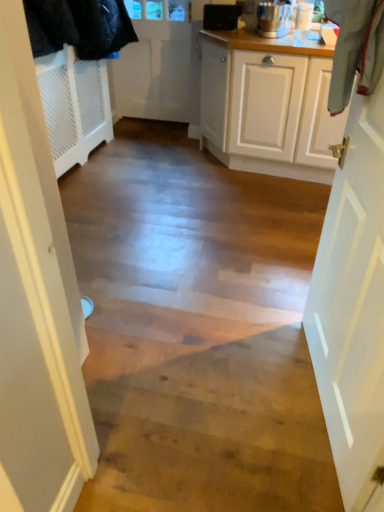
How much space does white matte door at upper center, acting as the 2th door starting from the bottom, occupy vertically?

white matte door at upper center, acting as the 2th door starting from the bottom, is 3.56 feet tall.

What do you see at coordinates (155, 63) in the screenshot?
I see `white matte door at upper center, which ranks as the first door in back-to-front order` at bounding box center [155, 63].

Locate an element on the screen. The height and width of the screenshot is (512, 384). black plastic speaker at upper center is located at coordinates (221, 17).

Considering the positions of objects white matte door at right, acting as the 2th door starting from the top, and black plastic speaker at upper center in the image provided, who is in front, white matte door at right, acting as the 2th door starting from the top, or black plastic speaker at upper center?

white matte door at right, acting as the 2th door starting from the top, is closer to the camera.

Identify the location of appliance above the white matte door at right, which is the second door from left to right (from the image's perspective). The width and height of the screenshot is (384, 512). (221, 17).

Considering the sizes of objects white matte door at right, acting as the 2th door starting from the top, and black plastic speaker at upper center in the image provided, who is bigger, white matte door at right, acting as the 2th door starting from the top, or black plastic speaker at upper center?

Bigger between the two is white matte door at right, acting as the 2th door starting from the top.

From a real-world perspective, which is physically above, white matte door at right, acting as the 2th door starting from the top, or polished stainless steel blender at upper right?

polished stainless steel blender at upper right is physically above.

Considering the points (381, 455) and (282, 15), which point is in front, point (381, 455) or point (282, 15)?

Point (381, 455)

Is white matte door at right, the first door positioned from the bottom, closer to camera compared to polished stainless steel blender at upper right?

Yes, white matte door at right, the first door positioned from the bottom, is in front of polished stainless steel blender at upper right.

Is white matte door at right, the second door in the back-to-front sequence, placed right next to polished stainless steel blender at upper right?

white matte door at right, the second door in the back-to-front sequence, is not next to polished stainless steel blender at upper right, and they're not touching.

Considering the sizes of objects black plastic speaker at upper center and polished stainless steel blender at upper right in the image provided, who is bigger, black plastic speaker at upper center or polished stainless steel blender at upper right?

polished stainless steel blender at upper right.

Is black plastic speaker at upper center inside or outside of polished stainless steel blender at upper right?

black plastic speaker at upper center exists outside the volume of polished stainless steel blender at upper right.

Which object is positioned more to the right, black plastic speaker at upper center or polished stainless steel blender at upper right?

polished stainless steel blender at upper right is more to the right.

Does black plastic speaker at upper center have a lesser width compared to polished stainless steel blender at upper right?

Correct, the width of black plastic speaker at upper center is less than that of polished stainless steel blender at upper right.

Between point (208, 15) and point (133, 11), which one is positioned behind?

The point (133, 11) is more distant.

Is black plastic speaker at upper center positioned with its back to white matte door at upper center, the second door positioned from the right?

No, white matte door at upper center, the second door positioned from the right, is not at the back of black plastic speaker at upper center.

At what (x,y) coordinates should I click in order to perform the action: click on appliance above the white matte door at upper center, the second door from the front (from a real-world perspective). Please return your answer as a coordinate pair (x, y). Image resolution: width=384 pixels, height=512 pixels. Looking at the image, I should click on (221, 17).

Which object is closer to the camera taking this photo, black plastic speaker at upper center or white matte door at upper center, the second door from the front?

black plastic speaker at upper center is more forward.

From a real-world perspective, which is physically below, polished stainless steel blender at upper right or white matte door at upper center, which ranks as the first door in back-to-front order?

white matte door at upper center, which ranks as the first door in back-to-front order.

Does point (268, 11) come behind point (180, 6)?

No, it is in front of (180, 6).

Based on the photo, can you confirm if polished stainless steel blender at upper right is shorter than white matte door at upper center, acting as the 2th door starting from the bottom?

Indeed, polished stainless steel blender at upper right has a lesser height compared to white matte door at upper center, acting as the 2th door starting from the bottom.

Is polished stainless steel blender at upper right far from white matte door at upper center, marked as the 1th door in a top-to-bottom arrangement?

Yes, polished stainless steel blender at upper right and white matte door at upper center, marked as the 1th door in a top-to-bottom arrangement, are located far from each other.

Does black plastic speaker at upper center contain white matte door at right, which is the second door from left to right?

Actually, white matte door at right, which is the second door from left to right, is outside black plastic speaker at upper center.

Which is closer to the camera, (214, 12) or (355, 2)?

Point (214, 12) is positioned farther from the camera compared to point (355, 2).

Considering the relative sizes of black plastic speaker at upper center and white matte door at right, placed as the first door when sorted from right to left, in the image provided, is black plastic speaker at upper center shorter than white matte door at right, placed as the first door when sorted from right to left,?

Indeed, black plastic speaker at upper center has a lesser height compared to white matte door at right, placed as the first door when sorted from right to left.

Looking at this image, is black plastic speaker at upper center further to camera compared to white matte door at right, which is the second door from left to right?

That is True.

From a real-world perspective, is white matte door at right, which is the second door from left to right, on white matte door at upper center, marked as the 1th door in a top-to-bottom arrangement?

No, from a real-world perspective, white matte door at right, which is the second door from left to right, is not on top of white matte door at upper center, marked as the 1th door in a top-to-bottom arrangement.

Looking at this image, between white matte door at right, which is counted as the 1th door, starting from the front, and white matte door at upper center, which ranks as the first door in back-to-front order, which one is positioned behind?

white matte door at upper center, which ranks as the first door in back-to-front order, is further away from the camera.

At what (x,y) coordinates should I click in order to perform the action: click on door on the left of the white matte door at right, the first door positioned from the bottom. Please return your answer as a coordinate pair (x, y). Image resolution: width=384 pixels, height=512 pixels. Looking at the image, I should click on (155, 63).

Is white matte door at right, which is the second door from left to right, to the left of white matte door at upper center, the second door positioned from the right, from the viewer's perspective?

Incorrect, white matte door at right, which is the second door from left to right, is not on the left side of white matte door at upper center, the second door positioned from the right.

This screenshot has height=512, width=384. Find the location of `appliance that is behind the white matte door at right, acting as the 2th door starting from the top`. appliance that is behind the white matte door at right, acting as the 2th door starting from the top is located at coordinates (221, 17).

At what (x,y) coordinates should I click in order to perform the action: click on door below the polished stainless steel blender at upper right (from the image's perspective). Please return your answer as a coordinate pair (x, y). The width and height of the screenshot is (384, 512). Looking at the image, I should click on coord(353,263).

Estimate the real-world distances between objects in this image. Which object is closer to polished stainless steel blender at upper right, white matte door at right, which is the second door from left to right, or black plastic speaker at upper center?

black plastic speaker at upper center is positioned closer to the anchor polished stainless steel blender at upper right.

Looking at the image, which one is located further to white matte door at upper center, the second door positioned from the right, black plastic speaker at upper center or polished stainless steel blender at upper right?

Among the two, polished stainless steel blender at upper right is located further to white matte door at upper center, the second door positioned from the right.

Considering their positions, is polished stainless steel blender at upper right positioned further to white matte door at right, which is counted as the 1th door, starting from the front, than black plastic speaker at upper center?

The object further to white matte door at right, which is counted as the 1th door, starting from the front, is black plastic speaker at upper center.

Looking at the image, which one is located further to white matte door at upper center, which ranks as the first door in back-to-front order, polished stainless steel blender at upper right or black plastic speaker at upper center?

Based on the image, polished stainless steel blender at upper right appears to be further to white matte door at upper center, which ranks as the first door in back-to-front order.

When comparing their distances from black plastic speaker at upper center, does white matte door at right, which is the second door from left to right, or white matte door at upper center, placed as the 1th door when sorted from left to right, seem closer?

The object closer to black plastic speaker at upper center is white matte door at upper center, placed as the 1th door when sorted from left to right.

Which object lies nearer to the anchor point polished stainless steel blender at upper right, white matte door at upper center, the second door positioned from the right, or black plastic speaker at upper center?

black plastic speaker at upper center.

From the image, which object appears to be nearer to black plastic speaker at upper center, white matte door at right, the second door in the back-to-front sequence, or polished stainless steel blender at upper right?

polished stainless steel blender at upper right is positioned closer to the anchor black plastic speaker at upper center.

From the image, which object appears to be nearer to white matte door at upper center, the second door positioned from the right, white matte door at right, which is counted as the 1th door, starting from the front, or black plastic speaker at upper center?

black plastic speaker at upper center.

I want to click on appliance between white matte door at upper center, the second door positioned from the right, and polished stainless steel blender at upper right from left to right, so click(x=221, y=17).

Locate an element on the screen. This screenshot has width=384, height=512. kitchen appliance between white matte door at right, placed as the first door when sorted from right to left, and black plastic speaker at upper center in the front-back direction is located at coordinates (274, 18).

At what (x,y) coordinates should I click in order to perform the action: click on kitchen appliance positioned between white matte door at right, acting as the 2th door starting from the top, and white matte door at upper center, the second door from the front, from near to far. Please return your answer as a coordinate pair (x, y). The image size is (384, 512). Looking at the image, I should click on (274, 18).

You are a GUI agent. You are given a task and a screenshot of the screen. Output one action in this format:
    pyautogui.click(x=<x>, y=<y>)
    Task: Click on the appliance located between white matte door at right, which is the second door from left to right, and white matte door at upper center, acting as the 2th door starting from the bottom, in the depth direction
    The height and width of the screenshot is (512, 384).
    Given the screenshot: What is the action you would take?
    pyautogui.click(x=221, y=17)